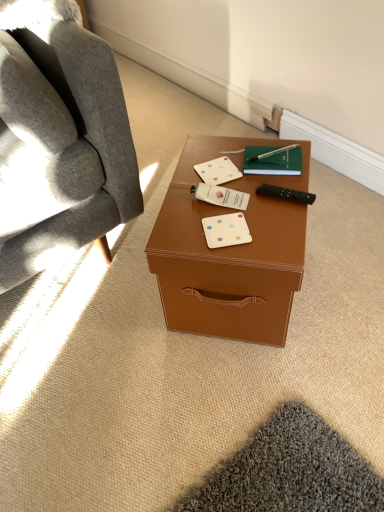
Where is `vacant space that is in between black plastic remote control at right and green matte notebook at center`? The width and height of the screenshot is (384, 512). vacant space that is in between black plastic remote control at right and green matte notebook at center is located at coordinates (277, 185).